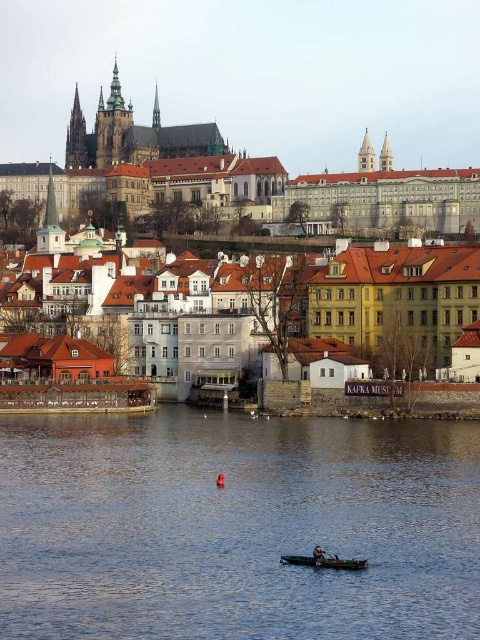
Question: Is dark brown stone castle at upper center further to camera compared to wooden canoe at lower center?

Choices:
 (A) yes
 (B) no

Answer: (A)

Question: Considering the relative positions of dark brown stone castle at upper center and wooden canoe at lower center in the image provided, where is dark brown stone castle at upper center located with respect to wooden canoe at lower center?

Choices:
 (A) above
 (B) below

Answer: (A)

Question: Which point appears closest to the camera in this image?

Choices:
 (A) (259, 173)
 (B) (315, 556)

Answer: (B)

Question: Which point is closer to the camera?

Choices:
 (A) blue water at lower center
 (B) brown/brick townhouses at center
 (C) dark blue fabric boat at lower center

Answer: (A)

Question: Among these points, which one is nearest to the camera?

Choices:
 (A) (314, 548)
 (B) (167, 419)

Answer: (A)

Question: Is brown/brick townhouses at center wider than dark blue fabric boat at lower center?

Choices:
 (A) no
 (B) yes

Answer: (B)